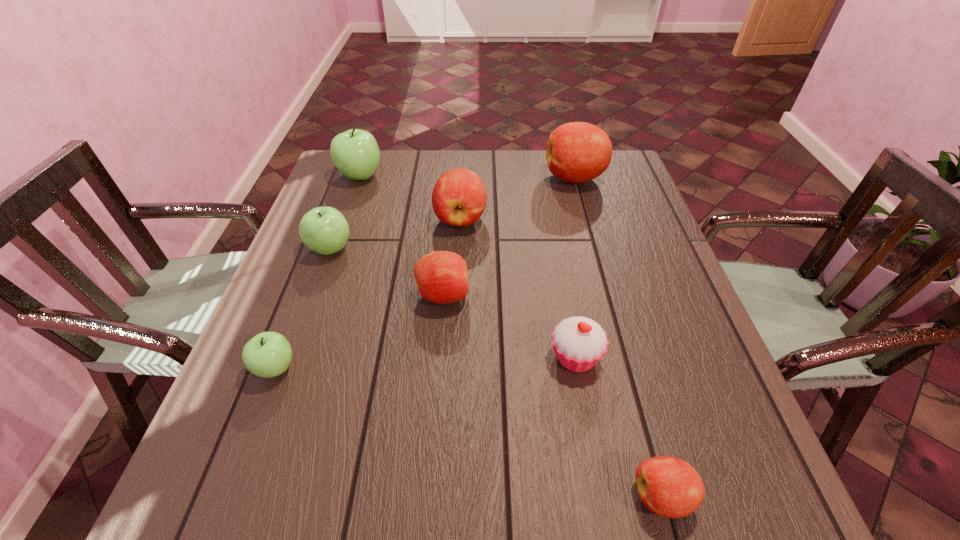
At what (x,y) coordinates should I click in order to perform the action: click on free space between the nearest apple and the cupcake. Please return your answer as a coordinate pair (x, y). The image size is (960, 540). Looking at the image, I should click on (618, 427).

Locate an element on the screen. Image resolution: width=960 pixels, height=540 pixels. empty space that is in between the nearest red apple and the farthest green apple is located at coordinates (511, 336).

You are a GUI agent. You are given a task and a screenshot of the screen. Output one action in this format:
    pyautogui.click(x=<x>, y=<y>)
    Task: Click on the free point between the biggest green apple and the second nearest red apple
    This screenshot has height=540, width=960.
    Given the screenshot: What is the action you would take?
    pyautogui.click(x=401, y=236)

This screenshot has width=960, height=540. In order to click on free space between the farthest red apple and the nearest object in this screenshot , I will do `click(618, 337)`.

At what (x,y) coordinates should I click in order to perform the action: click on free space between the third farthest red apple and the biggest green apple. Please return your answer as a coordinate pair (x, y). The height and width of the screenshot is (540, 960). Looking at the image, I should click on (401, 236).

Locate an element on the screen. Image resolution: width=960 pixels, height=540 pixels. free spot between the second farthest green apple and the third nearest red apple is located at coordinates (396, 234).

You are a GUI agent. You are given a task and a screenshot of the screen. Output one action in this format:
    pyautogui.click(x=<x>, y=<y>)
    Task: Click on the object that is the closest one to the nearest apple
    Image resolution: width=960 pixels, height=540 pixels.
    Given the screenshot: What is the action you would take?
    pyautogui.click(x=579, y=343)

This screenshot has width=960, height=540. I want to click on the third closest object to the third smallest red apple, so click(x=576, y=152).

Locate an element on the screen. The image size is (960, 540). apple that is the sixth closest to the cupcake is located at coordinates (576, 152).

Locate an element on the screen. apple that is the sixth nearest to the farthest green apple is located at coordinates (668, 486).